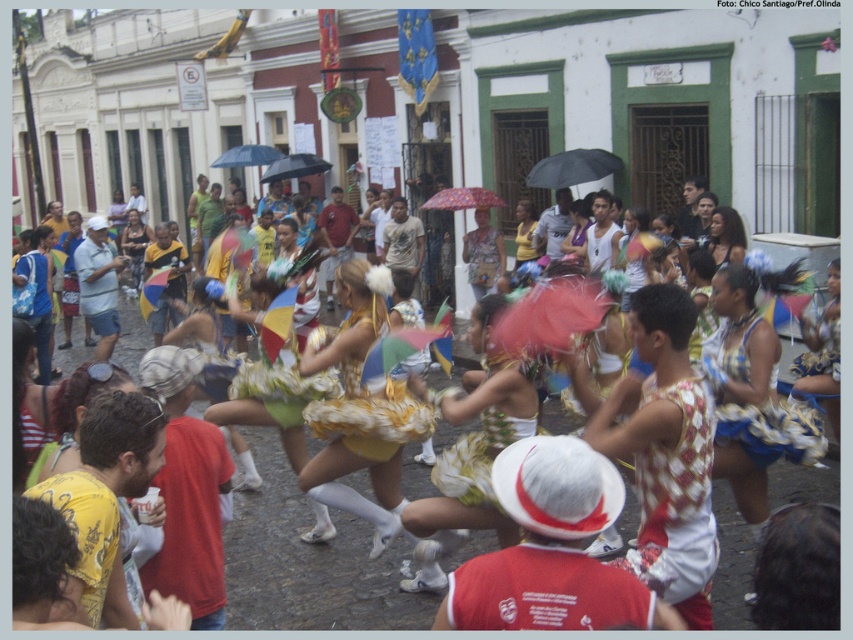
Between gold sequined dress at center and black matte umbrella at center, which one appears on the right side from the viewer's perspective?

From the viewer's perspective, black matte umbrella at center appears more on the right side.

The image size is (853, 640). Identify the location of gold sequined dress at center. (360, 408).

Is point (323, 550) positioned in front of point (369, 316)?

No, (323, 550) is further to viewer.

Between point (363, 612) and point (367, 342), which one is positioned in front?

Point (363, 612) is more forward.

The height and width of the screenshot is (640, 853). What do you see at coordinates (308, 563) in the screenshot?
I see `gold sequined costume at center` at bounding box center [308, 563].

This screenshot has height=640, width=853. I want to click on gold sequined costume at center, so click(x=308, y=563).

Does point (375, 589) come farther from viewer compared to point (321, 157)?

No.

Based on the photo, between gold sequined costume at center and black matte umbrella at upper center, which one has more height?

Standing taller between the two is gold sequined costume at center.

You are a GUI agent. You are given a task and a screenshot of the screen. Output one action in this format:
    pyautogui.click(x=<x>, y=<y>)
    Task: Click on the gold sequined costume at center
    The height and width of the screenshot is (640, 853).
    Given the screenshot: What is the action you would take?
    pyautogui.click(x=308, y=563)